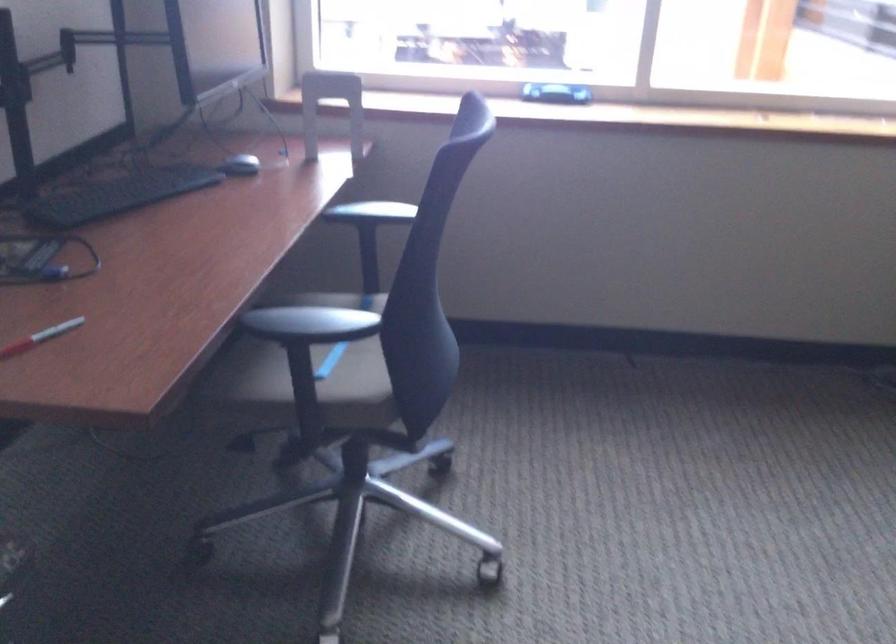
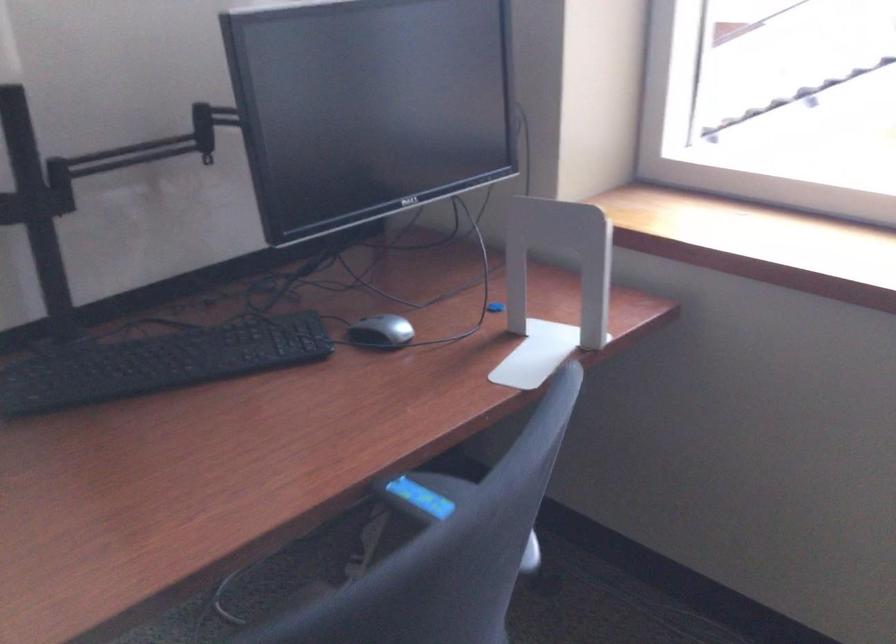
The point at (306, 142) is marked in the first image. Where is the corresponding point in the second image?

(554, 286)